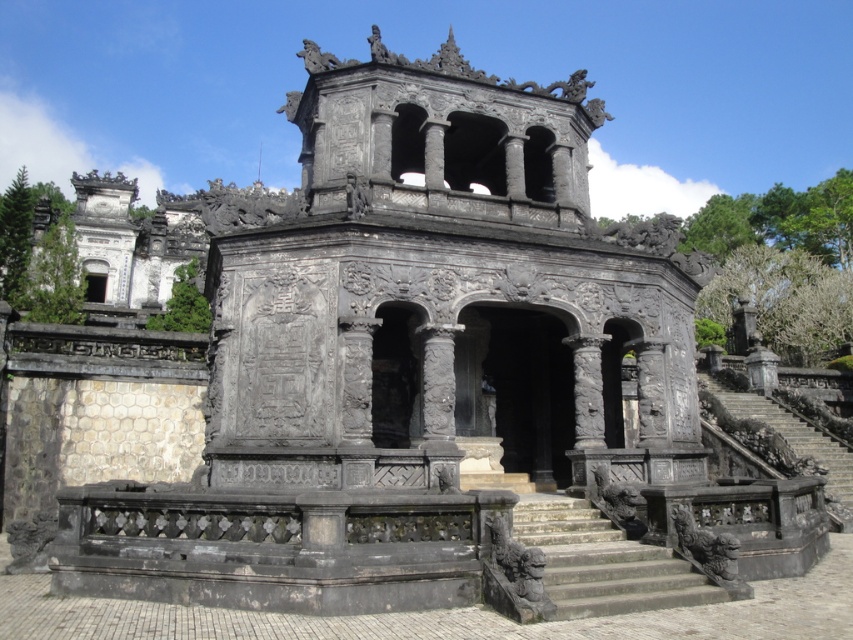
Where is `stone stairs at center`? stone stairs at center is located at coordinates (602, 561).

This screenshot has width=853, height=640. What do you see at coordinates (602, 561) in the screenshot?
I see `stone stairs at center` at bounding box center [602, 561].

Is point (566, 531) farther from camera compared to point (752, 467)?

No.

Identify the location of stone stairs at center. The height and width of the screenshot is (640, 853). (602, 561).